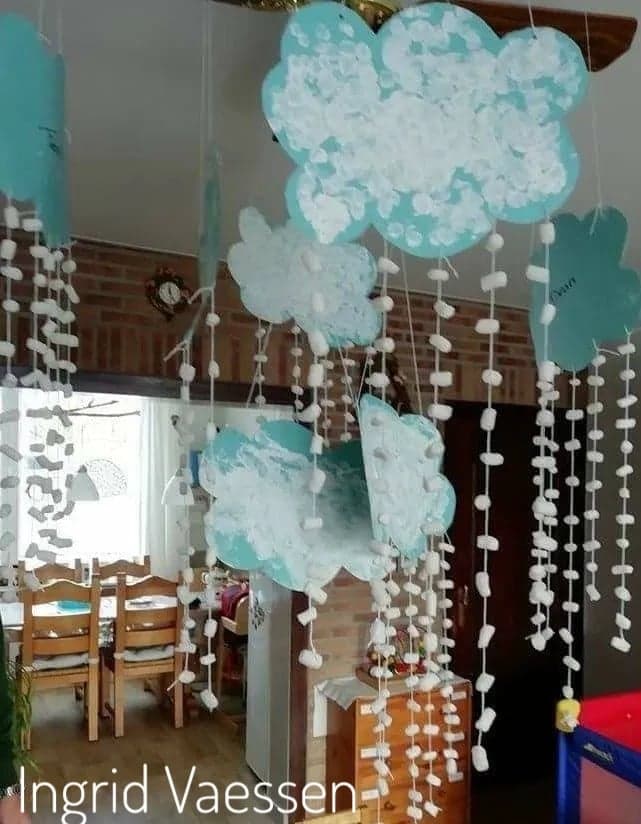
The image size is (641, 824). I want to click on wall, so click(x=140, y=40).